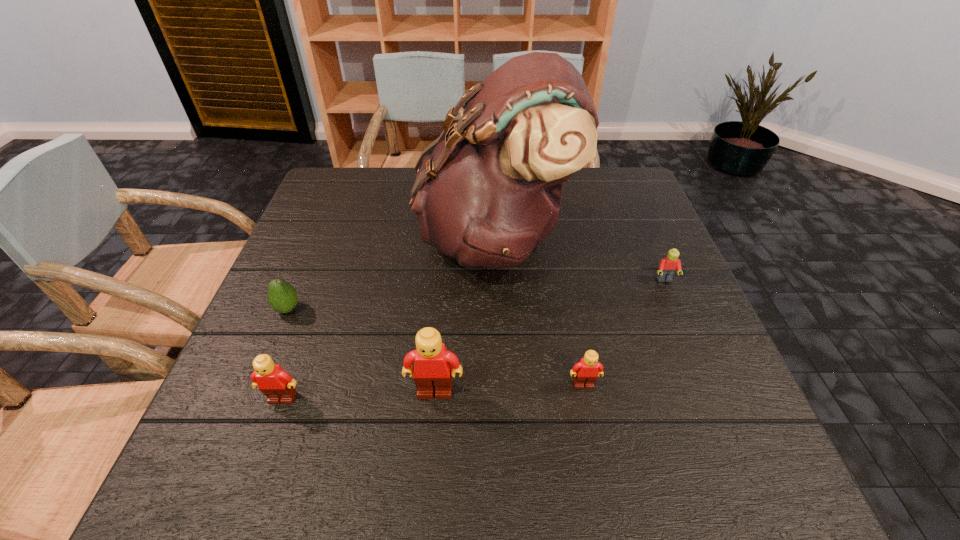
Locate an element on the screen. vacant space at the near edge of the desktop is located at coordinates (594, 393).

The image size is (960, 540). I want to click on free space at the left edge of the desktop, so click(265, 354).

Locate an element on the screen. Image resolution: width=960 pixels, height=540 pixels. free space at the right edge is located at coordinates (638, 247).

In the image, there is a desktop. Where is `free region at the far left corner`? Image resolution: width=960 pixels, height=540 pixels. free region at the far left corner is located at coordinates (361, 178).

This screenshot has height=540, width=960. In the image, there is a desktop. Identify the location of free space at the far right corner. coord(622,203).

The height and width of the screenshot is (540, 960). I want to click on vacant space at the near right corner of the desktop, so click(x=741, y=423).

The height and width of the screenshot is (540, 960). I want to click on free space between the second Lego from left to right and the third Lego from left to right, so click(x=509, y=388).

You are a GUI agent. You are given a task and a screenshot of the screen. Output one action in this format:
    pyautogui.click(x=<x>, y=<y>)
    Task: Click on the free space between the second tallest Lego and the rightmost object
    
    Given the screenshot: What is the action you would take?
    pyautogui.click(x=473, y=339)

You are a GUI agent. You are given a task and a screenshot of the screen. Output one action in this format:
    pyautogui.click(x=<x>, y=<y>)
    Task: Click on the empty space that is in between the tallest object and the rightmost object
    
    Given the screenshot: What is the action you would take?
    pyautogui.click(x=579, y=259)

The width and height of the screenshot is (960, 540). I want to click on empty location between the second Lego from left to right and the third shortest Lego, so click(359, 395).